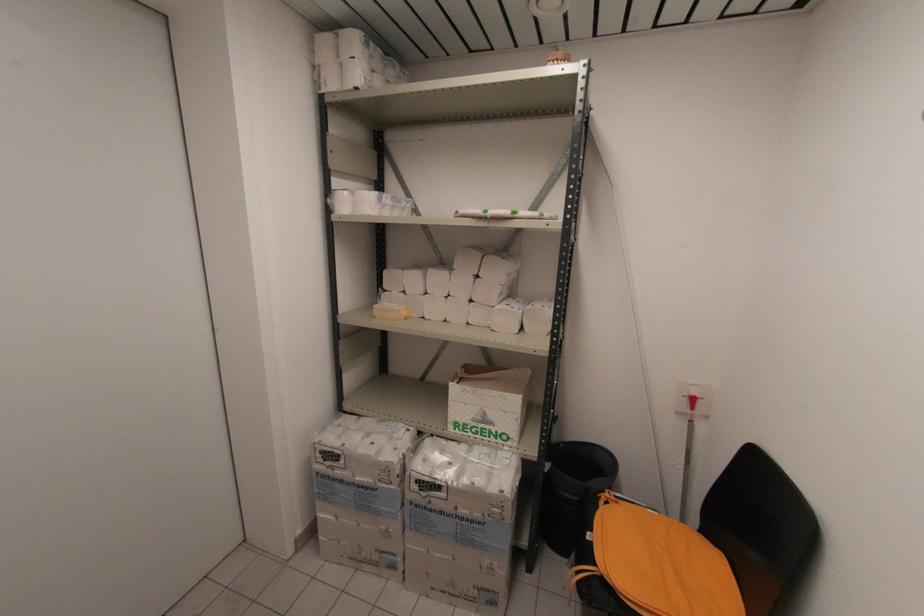
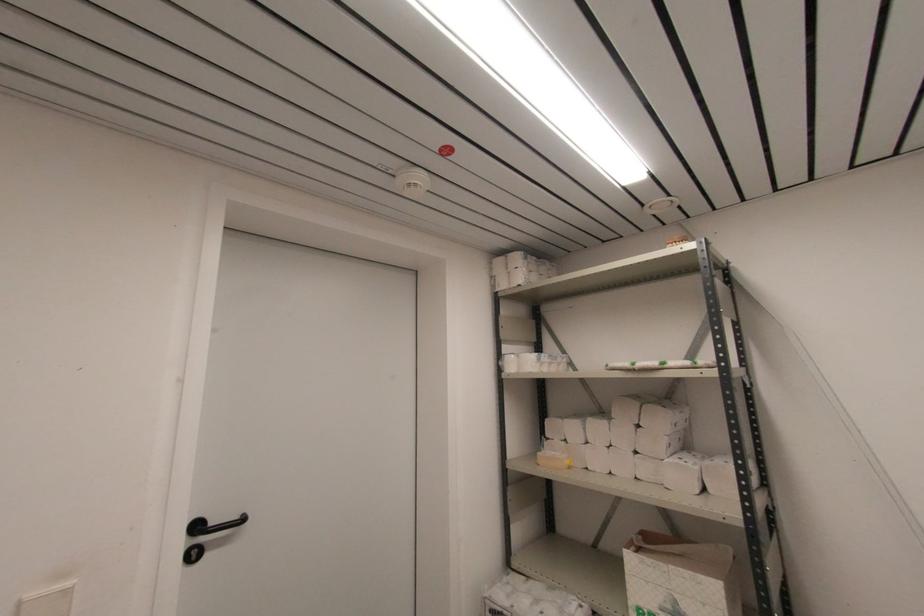
Find the pixel in the second image that matches the point at 333,188 in the first image.

(504, 354)